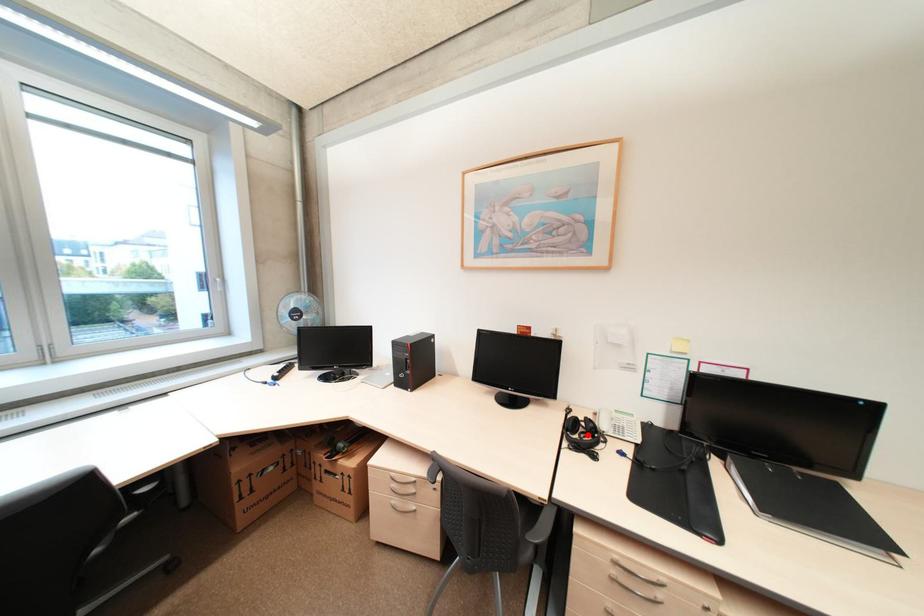
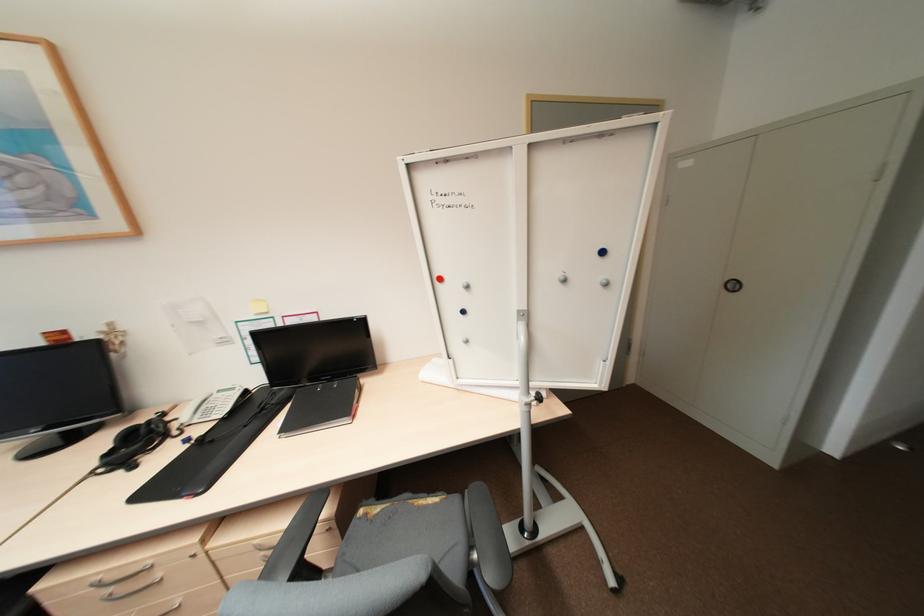
The point at the highlighted location is marked in the first image. Where is the corresponding point in the second image?

(142, 444)